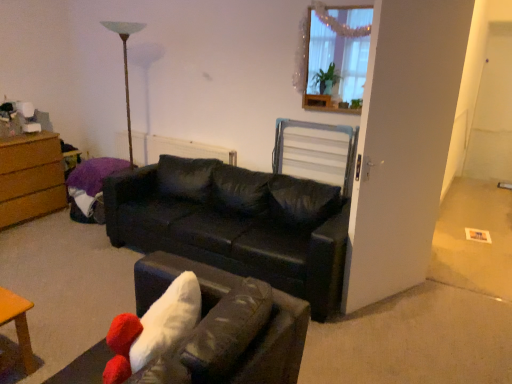
Question: Should I look upward or downward to see black leather couch at center, the first studio couch from the front?

Choices:
 (A) down
 (B) up

Answer: (A)

Question: Is the depth of white textured radiator at center greater than that of brown wood chest of drawers at left?

Choices:
 (A) yes
 (B) no

Answer: (A)

Question: Is white textured radiator at center located outside brown wood chest of drawers at left?

Choices:
 (A) yes
 (B) no

Answer: (A)

Question: Is white textured radiator at center closer to the viewer compared to brown wood chest of drawers at left?

Choices:
 (A) yes
 (B) no

Answer: (B)

Question: Would you consider white textured radiator at center to be distant from brown wood chest of drawers at left?

Choices:
 (A) yes
 (B) no

Answer: (B)

Question: Is white textured radiator at center facing away from brown wood chest of drawers at left?

Choices:
 (A) no
 (B) yes

Answer: (A)

Question: Considering the relative sizes of white textured radiator at center and brown wood chest of drawers at left in the image provided, is white textured radiator at center shorter than brown wood chest of drawers at left?

Choices:
 (A) no
 (B) yes

Answer: (B)

Question: Is the depth of black leather couch at center, the first studio couch from the front, less than that of wooden frame at upper right?

Choices:
 (A) no
 (B) yes

Answer: (B)

Question: Does black leather couch at center, the first studio couch from the front, have a smaller size compared to wooden frame at upper right?

Choices:
 (A) no
 (B) yes

Answer: (A)

Question: Could you tell me if black leather couch at center, the first studio couch from the front, is facing wooden frame at upper right?

Choices:
 (A) yes
 (B) no

Answer: (B)

Question: Considering the relative positions of black leather couch at center, acting as the 2th studio couch starting from the back, and wooden frame at upper right in the image provided, is black leather couch at center, acting as the 2th studio couch starting from the back, behind wooden frame at upper right?

Choices:
 (A) yes
 (B) no

Answer: (B)

Question: From a real-world perspective, is black leather couch at center, the first studio couch from the front, positioned over wooden frame at upper right based on gravity?

Choices:
 (A) yes
 (B) no

Answer: (B)

Question: Considering the relative sizes of wooden frame at upper right and metallic silver swivel chair at center in the image provided, is wooden frame at upper right bigger than metallic silver swivel chair at center?

Choices:
 (A) yes
 (B) no

Answer: (B)